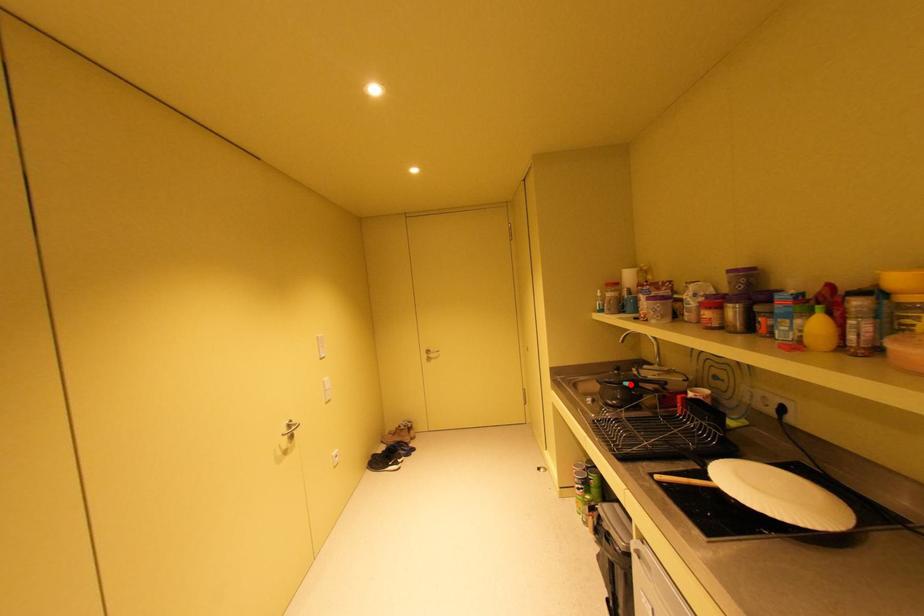
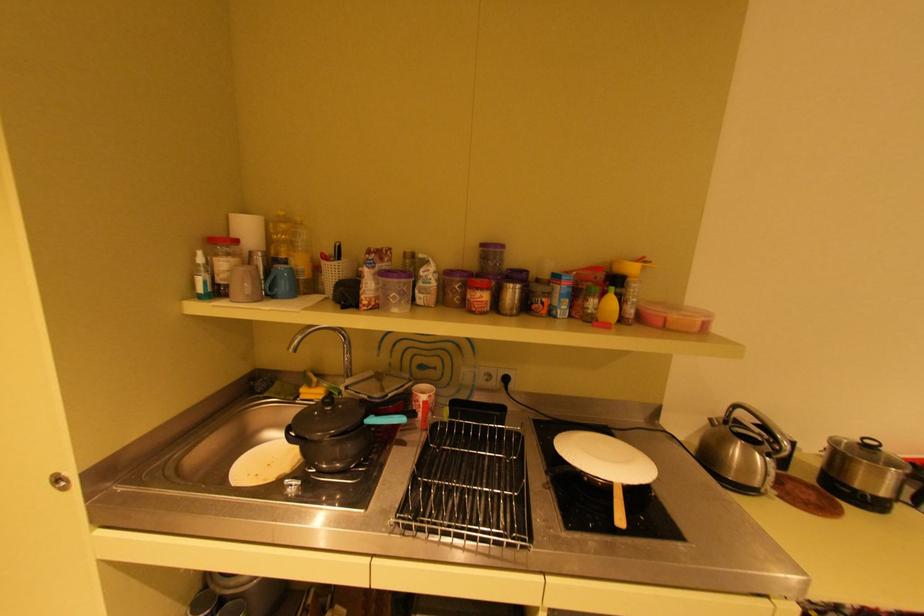
In the second image, find the point that corresponds to the highlighted location in the first image.

(371, 424)